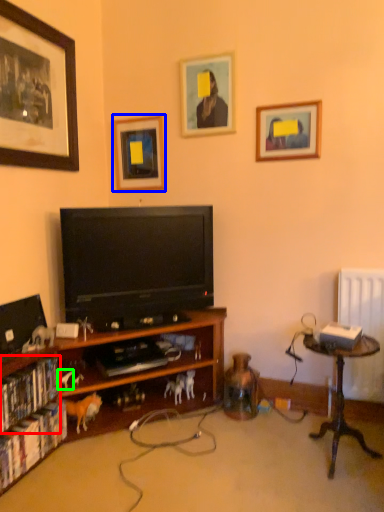
Question: Which object is positioned closest to book (highlighted by a red box)? Select from picture frame (highlighted by a blue box) and animal (highlighted by a green box).

Choices:
 (A) picture frame
 (B) animal

Answer: (B)